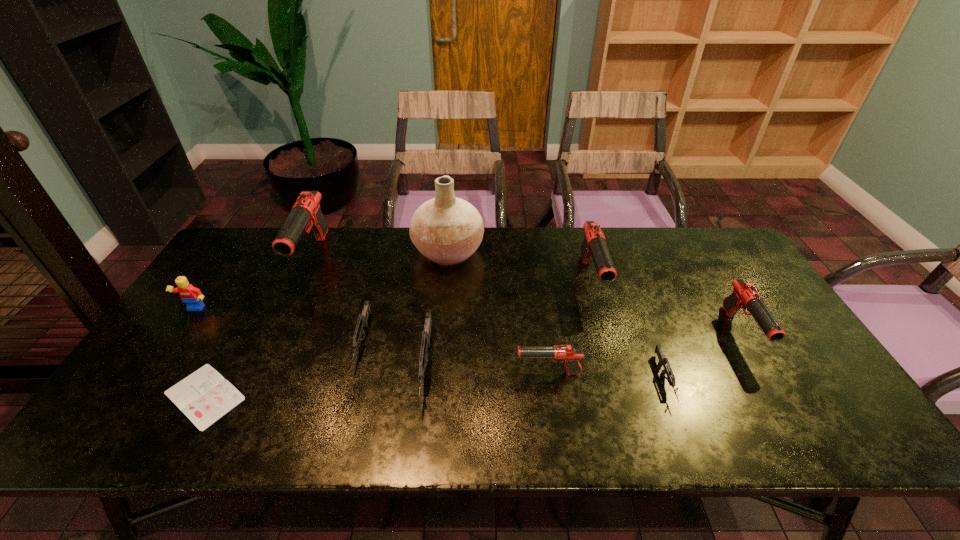
Identify the location of free space between the shortest object and the yellow Lego. The height and width of the screenshot is (540, 960). (200, 353).

The width and height of the screenshot is (960, 540). What are the coordinates of `free space that is in between the rightmost grey gun and the second biggest grey gun` in the screenshot? It's located at (514, 360).

At what (x,y) coordinates should I click in order to perform the action: click on object that stands as the sixth closest to the fifth shortest gun. Please return your answer as a coordinate pair (x, y). Looking at the image, I should click on (362, 322).

Locate which object is the fifth closest to the rightmost grey gun. Please provide its 2D coordinates. Your answer should be formatted as a tuple, i.e. [(x, y)], where the tuple contains the x and y coordinates of a point satisfying the conditions above.

[(426, 334)]

What are the coordinates of `the fourth closest gun to the second smallest black gun` in the screenshot? It's located at (426, 334).

The image size is (960, 540). I want to click on gun that can be found as the fifth closest to the second smallest black gun, so click(x=362, y=322).

This screenshot has height=540, width=960. I want to click on black gun that stands as the closest to the third smallest black gun, so click(x=568, y=354).

This screenshot has height=540, width=960. Identify the location of black gun object that ranks as the third closest to the second biggest black gun. (306, 212).

This screenshot has width=960, height=540. Identify the location of grey gun that is the closest to the second black gun from right to left. (667, 370).

This screenshot has height=540, width=960. Find the location of `grey gun that is the third closest to the leftmost gun`. grey gun that is the third closest to the leftmost gun is located at coordinates (667, 370).